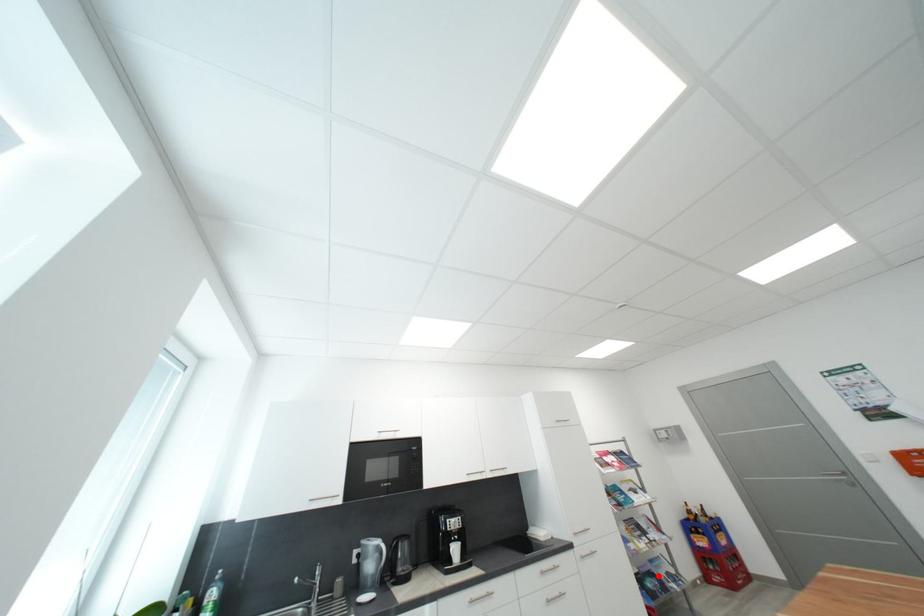
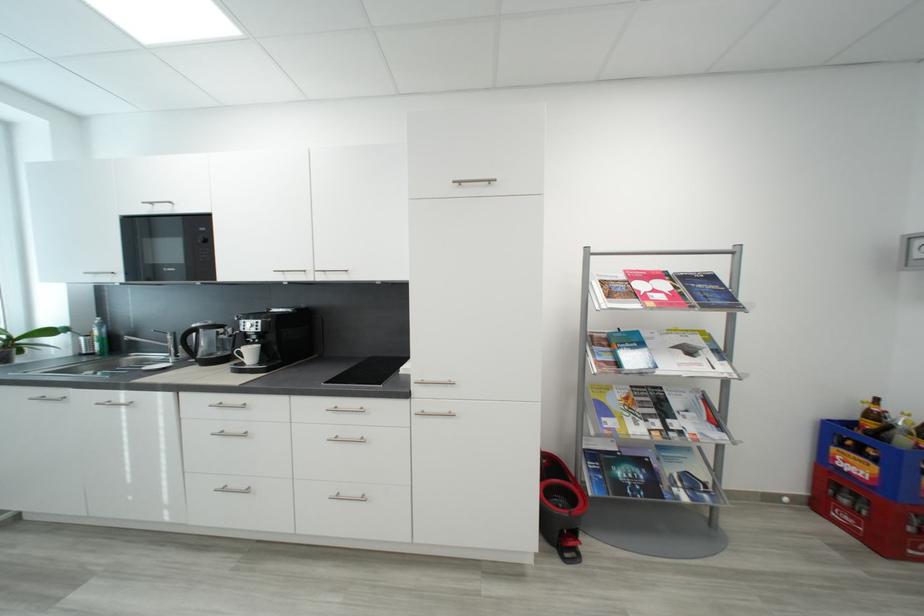
Question: I am providing you with two images of the same scene from different viewpoints. A red point is shown in image1. For the corresponding object point in image2, is it positioned nearer or farther from the camera?

Choices:
 (A) Nearer
 (B) Farther

Answer: (B)